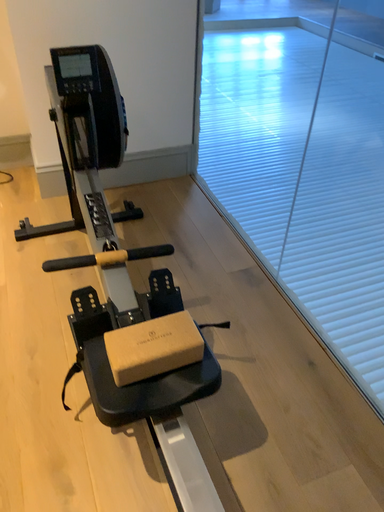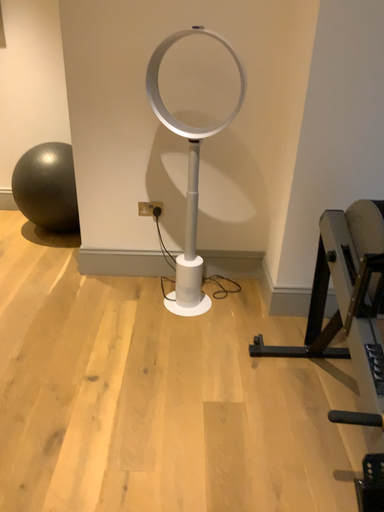
Question: How did the camera likely rotate when shooting the video?

Choices:
 (A) rotated left
 (B) rotated right

Answer: (A)